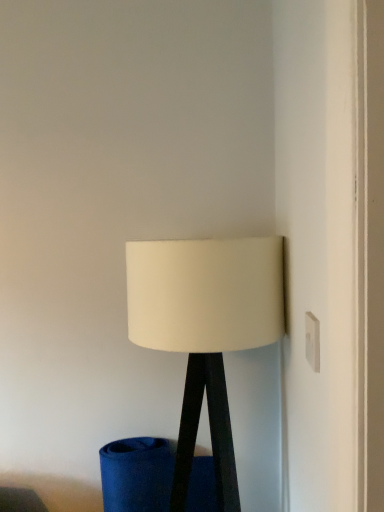
Question: Considering the positions of white matte lampshade at center and white plastic electric outlet at upper right in the image, is white matte lampshade at center taller or shorter than white plastic electric outlet at upper right?

Choices:
 (A) tall
 (B) short

Answer: (A)

Question: In terms of width, does white matte lampshade at center look wider or thinner when compared to white plastic electric outlet at upper right?

Choices:
 (A) thin
 (B) wide

Answer: (B)

Question: Is point (230, 271) positioned closer to the camera than point (316, 329)?

Choices:
 (A) farther
 (B) closer

Answer: (A)

Question: In terms of width, does white plastic electric outlet at upper right look wider or thinner when compared to white matte lampshade at center?

Choices:
 (A) wide
 (B) thin

Answer: (B)

Question: Is white plastic electric outlet at upper right taller or shorter than white matte lampshade at center?

Choices:
 (A) tall
 (B) short

Answer: (B)

Question: From a real-world perspective, is white plastic electric outlet at upper right physically located above or below white matte lampshade at center?

Choices:
 (A) below
 (B) above

Answer: (B)

Question: Considering their positions, is white plastic electric outlet at upper right located in front of or behind white matte lampshade at center?

Choices:
 (A) front
 (B) behind

Answer: (A)